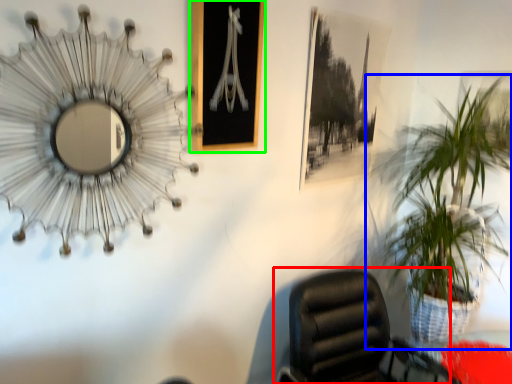
Question: Which is farther away from chair (highlighted by a red box)? houseplant (highlighted by a blue box) or picture frame (highlighted by a green box)?

Choices:
 (A) houseplant
 (B) picture frame

Answer: (B)